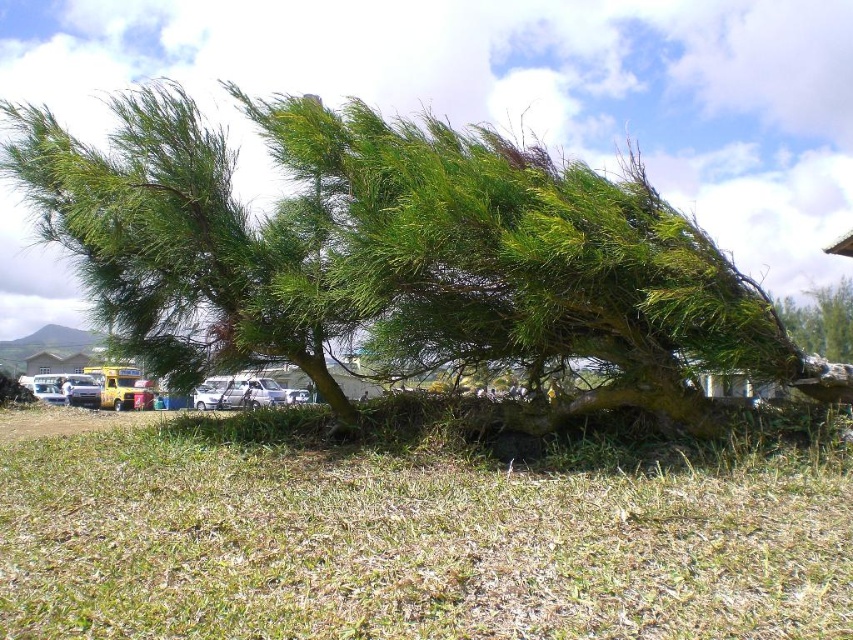
Between green dry grass at lower center and white matte car at center, which one is positioned higher?

green dry grass at lower center is above.

Is point (399, 634) closer to camera compared to point (196, 408)?

Yes, point (399, 634) is in front of point (196, 408).

Describe the element at coordinates (408, 541) in the screenshot. I see `green dry grass at lower center` at that location.

Locate an element on the screen. green dry grass at lower center is located at coordinates (408, 541).

Describe the element at coordinates (392, 253) in the screenshot. The height and width of the screenshot is (640, 853). I see `green leafy tree at center` at that location.

Can you confirm if green leafy tree at center is positioned to the left of green leafy tree at upper right?

Indeed, green leafy tree at center is positioned on the left side of green leafy tree at upper right.

The width and height of the screenshot is (853, 640). What do you see at coordinates (392, 253) in the screenshot? I see `green leafy tree at center` at bounding box center [392, 253].

Locate an element on the screen. The height and width of the screenshot is (640, 853). green leafy tree at center is located at coordinates (392, 253).

Who is higher up, green leafy tree at center or white matte car at center?

green leafy tree at center is above.

Between point (440, 248) and point (213, 408), which one is positioned in front?

Point (440, 248) is in front.

Where is `green leafy tree at center`? green leafy tree at center is located at coordinates (392, 253).